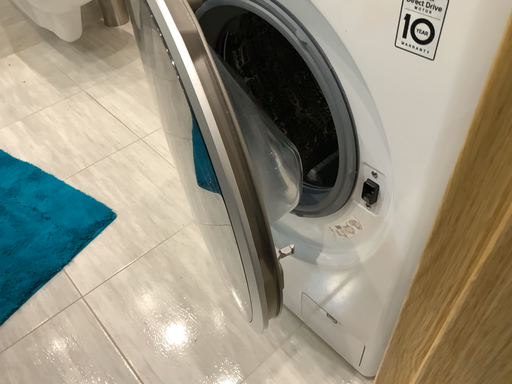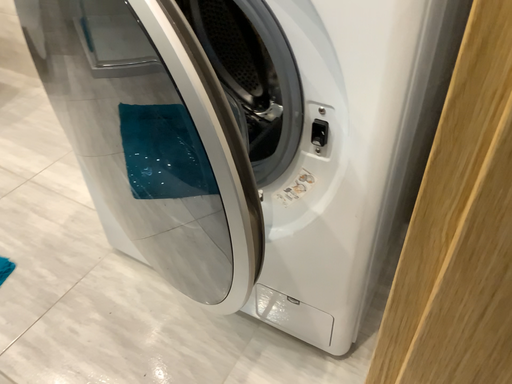
Question: How did the camera likely rotate when shooting the video?

Choices:
 (A) rotated left
 (B) rotated right

Answer: (B)